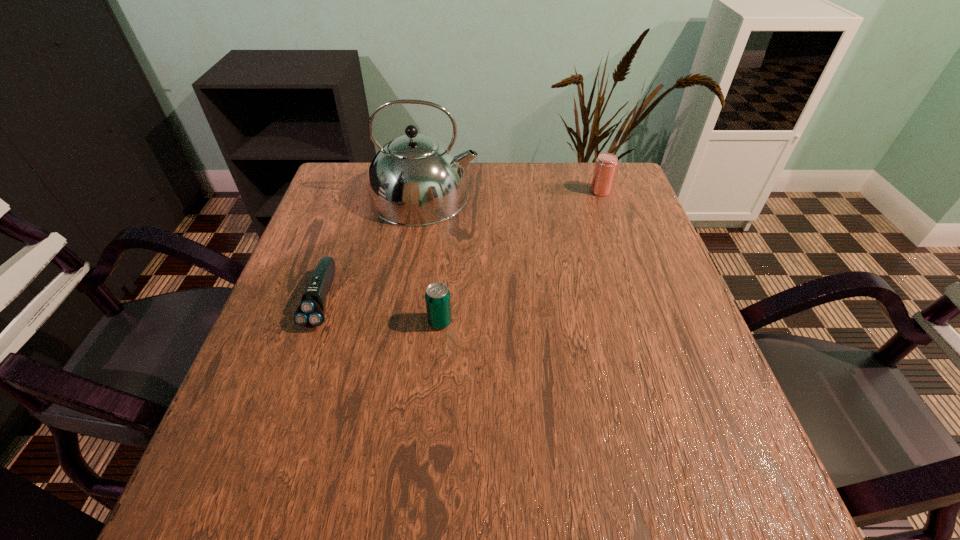
Where is `empty space that is in between the tallest object and the right beer can`? This screenshot has width=960, height=540. empty space that is in between the tallest object and the right beer can is located at coordinates tap(513, 194).

At what (x,y) coordinates should I click in order to perform the action: click on empty space that is in between the nearer beer can and the electric shaver. Please return your answer as a coordinate pair (x, y). The height and width of the screenshot is (540, 960). Looking at the image, I should click on (381, 311).

Select which object is the closest to the farther beer can. Please provide its 2D coordinates. Your answer should be formatted as a tuple, i.e. [(x, y)], where the tuple contains the x and y coordinates of a point satisfying the conditions above.

[(415, 180)]

Locate an element on the screen. This screenshot has width=960, height=540. object that is the second closest to the right beer can is located at coordinates (437, 296).

Locate an element on the screen. The image size is (960, 540). vacant area in the image that satisfies the following two spatial constraints: 1. from the spout of the kettle; 2. on the back side of the left beer can is located at coordinates (404, 322).

Image resolution: width=960 pixels, height=540 pixels. Find the location of `free space that satisfies the following two spatial constraints: 1. on the back side of the left beer can; 2. from the spout of the tallest object`. free space that satisfies the following two spatial constraints: 1. on the back side of the left beer can; 2. from the spout of the tallest object is located at coordinates [x=450, y=196].

What are the coordinates of `blank area in the image that satisfies the following two spatial constraints: 1. on the head of the nearer beer can; 2. on the left side of the leftmost object` in the screenshot? It's located at (315, 322).

Where is `free region that satisfies the following two spatial constraints: 1. from the spout of the tallest object; 2. on the head of the shortest object`? free region that satisfies the following two spatial constraints: 1. from the spout of the tallest object; 2. on the head of the shortest object is located at coordinates (408, 300).

Locate an element on the screen. The image size is (960, 540). vacant space that satisfies the following two spatial constraints: 1. on the head of the shortest object; 2. on the left side of the left beer can is located at coordinates (315, 322).

Image resolution: width=960 pixels, height=540 pixels. Identify the location of vacant area that satisfies the following two spatial constraints: 1. on the head of the nearer beer can; 2. on the left side of the electric shaver. (315, 322).